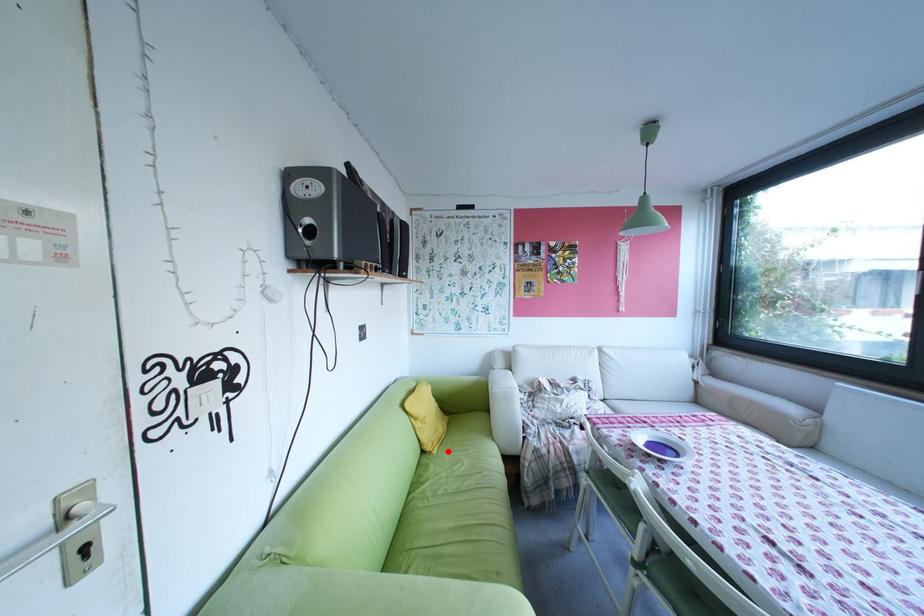
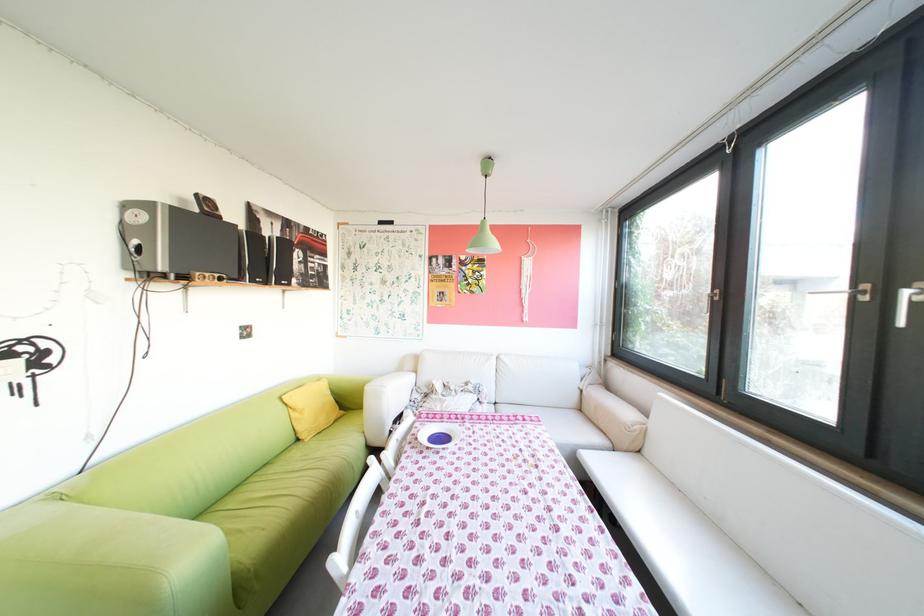
Locate, in the second image, the point that corresponds to the highlighted location in the first image.

(321, 440)